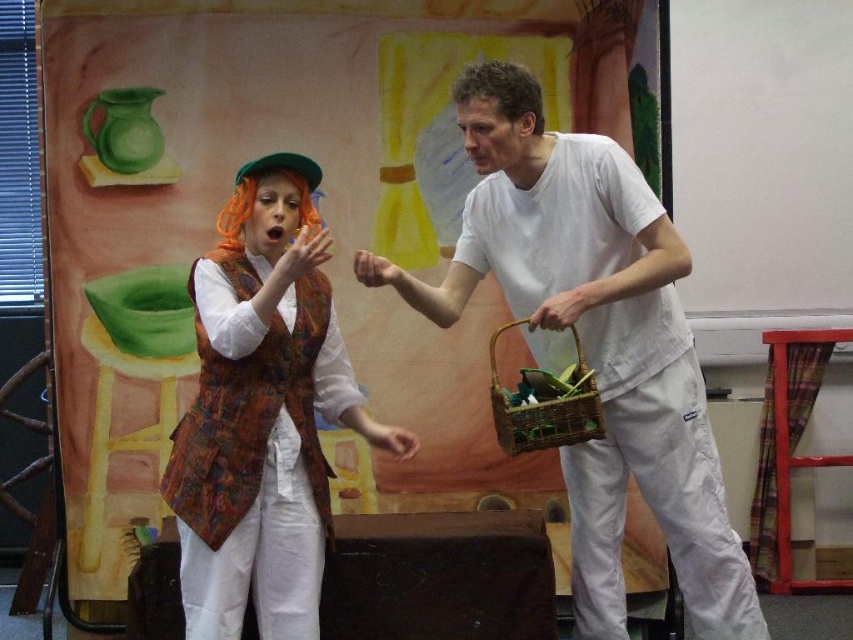
You are a stagehand preparing to adjust the lighting for the performers. The printed fabric vest at center and the woven brown basket at right are part of the set. If the minimum distance required between the two objects for proper lighting is 24 inches, will you need to move them closer or farther apart?

The printed fabric vest at center is 23.37 inches away from the woven brown basket at right. Since the required minimum distance is 24 inches, you need to move them farther apart to meet the requirement.

You are a stagehand who needs to place a prop exactly at the center of the stage. The stage has a coordinate system where the bottom left corner is at point 0,0 and the top right corner is at point 1,1. You see the white matte shirt at center on stage. Is the prop placement at the exact center of the stage?

The white matte shirt at center is located at point (x=595, y=342), which is slightly to the right and below the exact center of the stage. Therefore, the prop placement is not at the exact center of the stage.

You are a stagehand who needs to adjust the lighting for the performer wearing the white matte shirt at center and the woven brown basket at right. Since the shirt is taller than the basket, which object requires a higher spotlight to ensure proper illumination?

The white matte shirt at center requires a higher spotlight because it has a greater height compared to the woven brown basket at right.